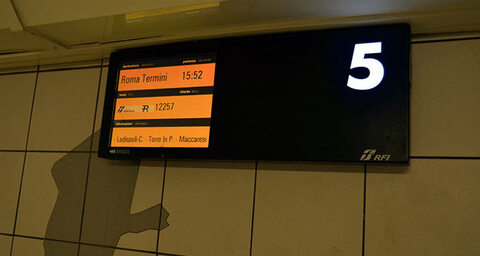
Locate an element on the screen. ceiling is located at coordinates pos(18,42), pos(73,32), pos(377,8).